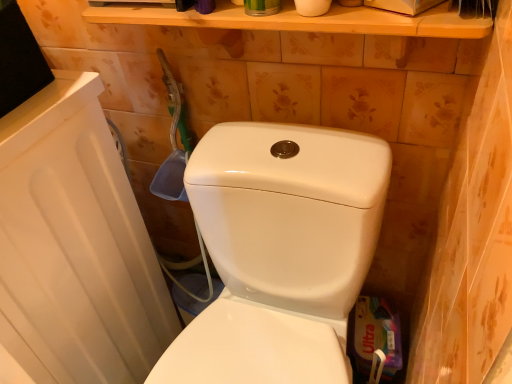
Question: Is white glossy toilet at center wider than white matte toilet paper at upper center?

Choices:
 (A) yes
 (B) no

Answer: (A)

Question: Can you confirm if white glossy toilet at center is bigger than white matte toilet paper at upper center?

Choices:
 (A) no
 (B) yes

Answer: (B)

Question: Is white glossy toilet at center outside white matte toilet paper at upper center?

Choices:
 (A) yes
 (B) no

Answer: (A)

Question: Considering the relative sizes of white glossy toilet at center and white matte toilet paper at upper center in the image provided, is white glossy toilet at center shorter than white matte toilet paper at upper center?

Choices:
 (A) yes
 (B) no

Answer: (B)

Question: From a real-world perspective, is white glossy toilet at center below white matte toilet paper at upper center?

Choices:
 (A) no
 (B) yes

Answer: (B)

Question: Considering the relative sizes of white glossy toilet at center and white matte toilet paper at upper center in the image provided, is white glossy toilet at center smaller than white matte toilet paper at upper center?

Choices:
 (A) no
 (B) yes

Answer: (A)

Question: Is white matte toilet paper at upper center positioned far away from white glossy toilet at center?

Choices:
 (A) yes
 (B) no

Answer: (B)

Question: Is white matte toilet paper at upper center touching white glossy toilet at center?

Choices:
 (A) no
 (B) yes

Answer: (A)

Question: From the image's perspective, is white matte toilet paper at upper center on white glossy toilet at center?

Choices:
 (A) yes
 (B) no

Answer: (A)

Question: Is white matte toilet paper at upper center oriented towards white glossy toilet at center?

Choices:
 (A) yes
 (B) no

Answer: (B)

Question: From a real-world perspective, is white matte toilet paper at upper center physically above white glossy toilet at center?

Choices:
 (A) no
 (B) yes

Answer: (B)

Question: Is white matte toilet paper at upper center shorter than white glossy toilet at center?

Choices:
 (A) yes
 (B) no

Answer: (A)

Question: Considering the relative positions of white glossy toilet at center and white matte toilet paper at upper center in the image provided, is white glossy toilet at center to the left or to the right of white matte toilet paper at upper center?

Choices:
 (A) right
 (B) left

Answer: (B)